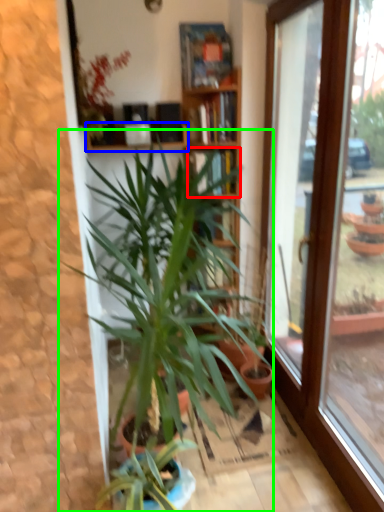
Question: Which object is positioned closest to shelf (highlighted by a red box)? Select from shelf (highlighted by a blue box) and houseplant (highlighted by a green box).

Choices:
 (A) shelf
 (B) houseplant

Answer: (A)